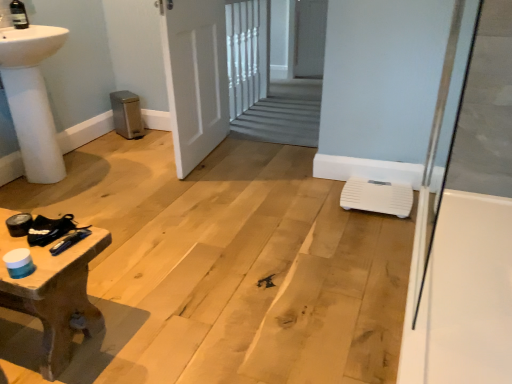
At what (x,y) coordinates should I click in order to perform the action: click on blank area to the left of white matte door at center. Please return your answer as a coordinate pair (x, y). This screenshot has width=512, height=384. Looking at the image, I should click on (143, 157).